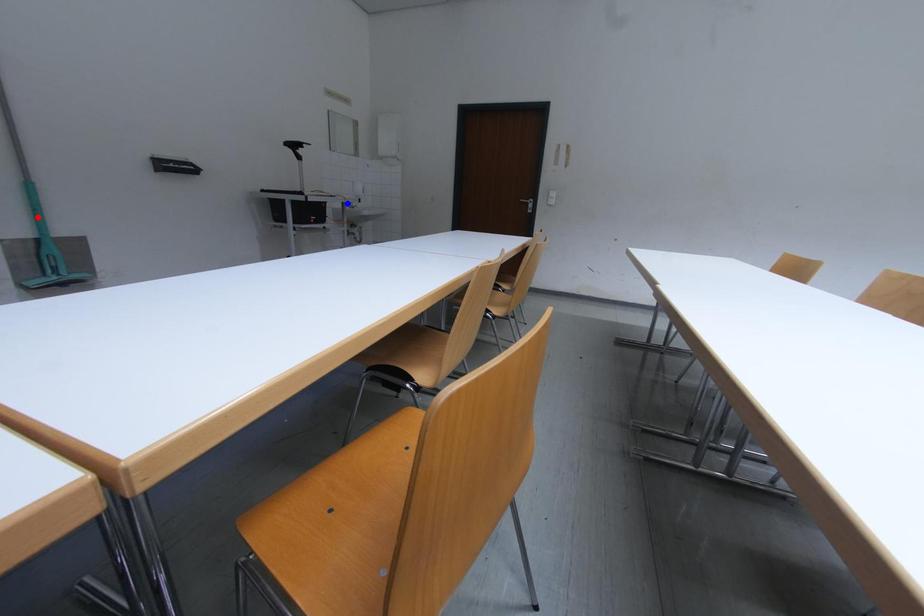
Question: Two points are marked on the image. Which point is closer to the camera?

Choices:
 (A) Blue point is closer.
 (B) Red point is closer.

Answer: (B)